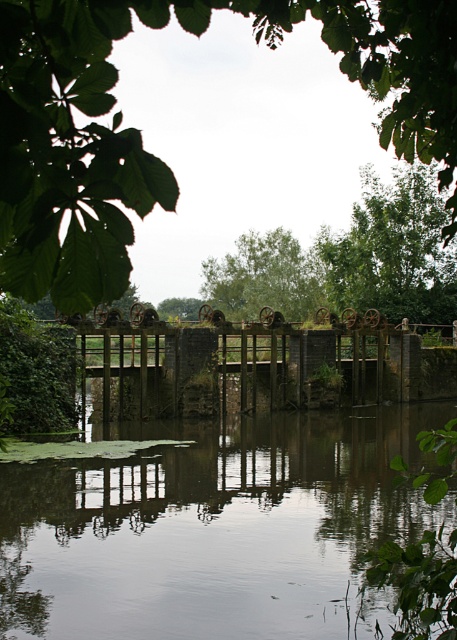
Looking at this image, which of these two, green leafy tree at upper center or rusty metal fence at center, stands taller?

green leafy tree at upper center is taller.

Is point (441, 60) closer to camera compared to point (287, 376)?

That is True.

You are a GUI agent. You are given a task and a screenshot of the screen. Output one action in this format:
    pyautogui.click(x=<x>, y=<y>)
    Task: Click on the green leafy tree at upper center
    Image resolution: width=457 pixels, height=640 pixels.
    Given the screenshot: What is the action you would take?
    pyautogui.click(x=138, y=131)

Between point (57, 243) and point (212, 288), which one is positioned in front?

Positioned in front is point (57, 243).

Is green leafy tree at upper center positioned at the back of green leafy tree at center?

No, green leafy tree at upper center is closer to the viewer.

Is point (389, 92) positioned in front of point (221, 289)?

Yes, point (389, 92) is closer to viewer.

I want to click on green leafy tree at upper center, so click(x=138, y=131).

What do you see at coordinates (212, 525) in the screenshot? I see `smooth reflective water at center` at bounding box center [212, 525].

Between point (37, 483) and point (452, 349), which one is positioned in front?

Point (37, 483) is more forward.

Find the location of a particular element. This screenshot has height=640, width=457. smooth reflective water at center is located at coordinates (212, 525).